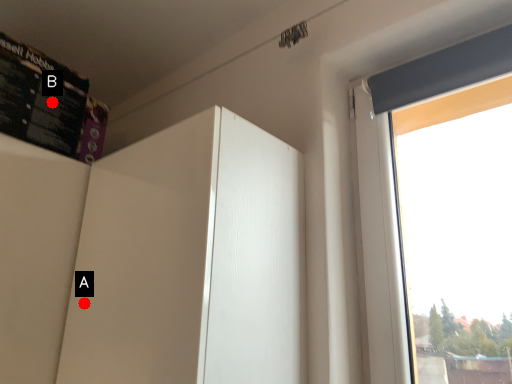
Question: Two points are circled on the image, labeled by A and B beside each circle. Which point is closer to the camera?

Choices:
 (A) A is closer
 (B) B is closer

Answer: (A)